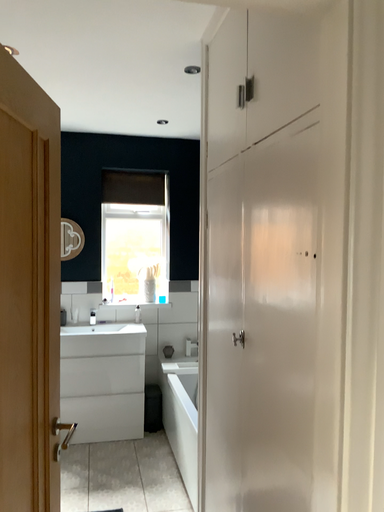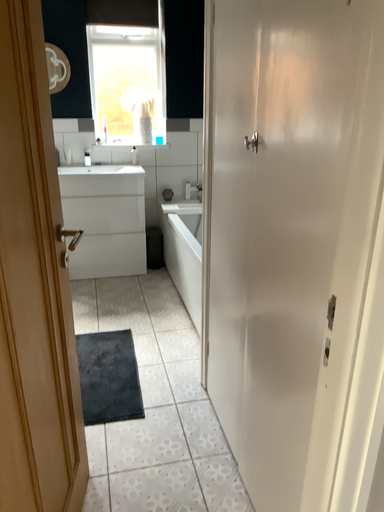
Question: How did the camera likely rotate when shooting the video?

Choices:
 (A) rotated upward
 (B) rotated downward

Answer: (B)